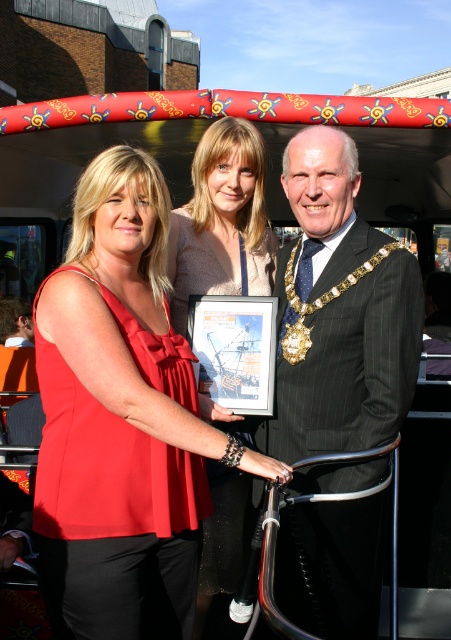
What is the color of the blouse worn by the person standing at the coordinates point (123, 419)?

The person at point (123, 419) is wearing a matte red blouse.